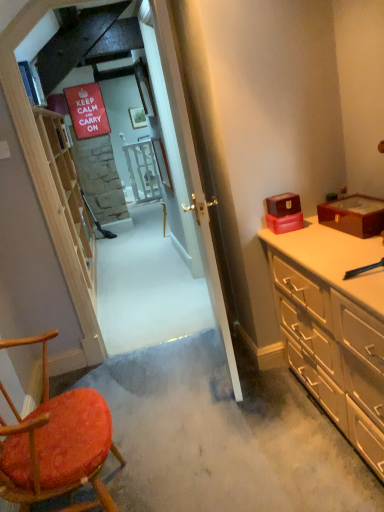
Locate an element on the screen. The width and height of the screenshot is (384, 512). vacant area that lies between shiny burgundy box at right, which appears as the second box when viewed from the left, and matte red box at right, the 1th box when ordered from left to right is located at coordinates (316, 233).